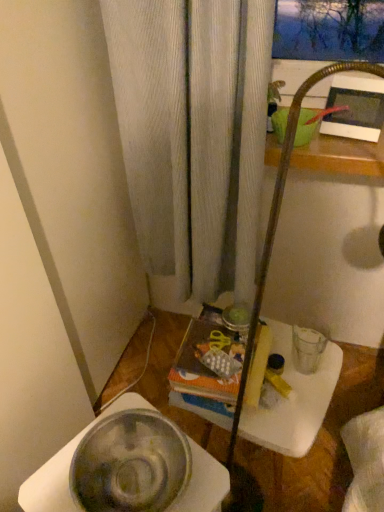
Identify the location of free region under metallic silver bowl at lower left, which is the 2th basin in back-to-front order (from a real-world perspective). The image size is (384, 512). (134, 478).